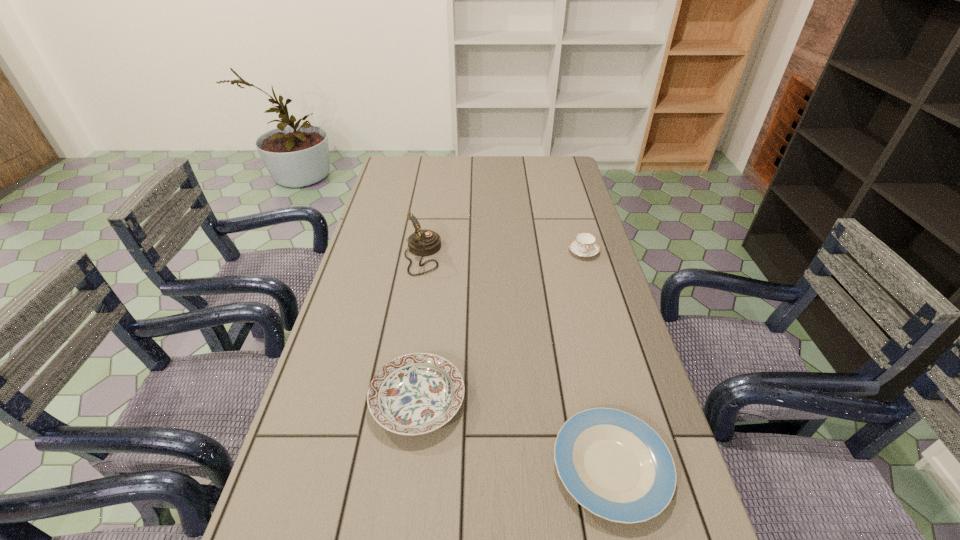
The image size is (960, 540). In order to click on object that can be found as the closest to the teacup in this screenshot , I will do pyautogui.click(x=424, y=242).